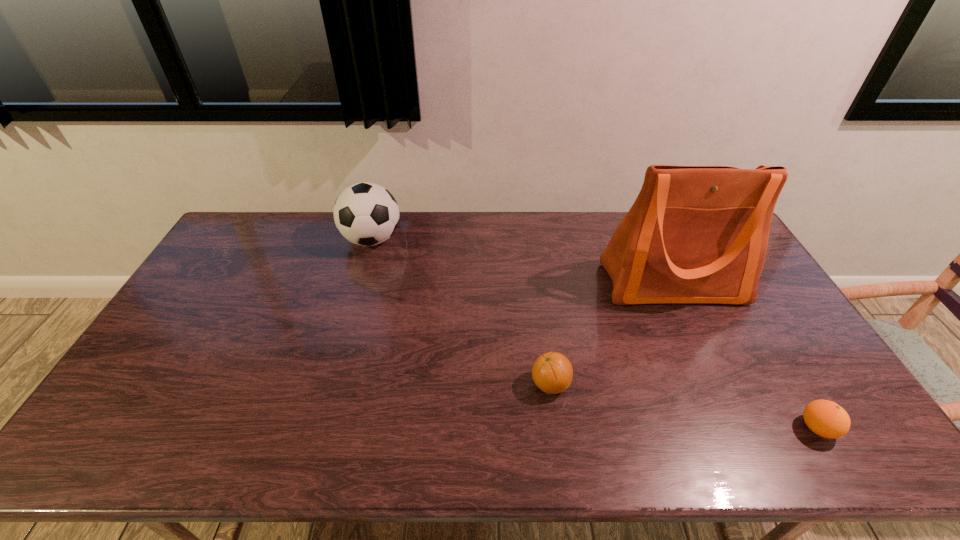
At what (x,y) coordinates should I click in order to perform the action: click on free region located on the back of the right orange. Please return your answer as a coordinate pair (x, y). Looking at the image, I should click on (780, 366).

At what (x,y) coordinates should I click in order to perform the action: click on object at the far edge. Please return your answer as a coordinate pair (x, y). This screenshot has width=960, height=540. Looking at the image, I should click on (367, 214).

In order to click on object situated at the near edge in this screenshot , I will do `click(825, 418)`.

Locate an element on the screen. This screenshot has width=960, height=540. shopping bag located at the right edge is located at coordinates (695, 234).

You are a GUI agent. You are given a task and a screenshot of the screen. Output one action in this format:
    pyautogui.click(x=<x>, y=<y>)
    Task: Click on the orange that is at the right edge
    
    Given the screenshot: What is the action you would take?
    pyautogui.click(x=825, y=418)

The width and height of the screenshot is (960, 540). Identify the location of object that is at the near right corner. (825, 418).

This screenshot has height=540, width=960. I want to click on blank space at the far edge of the desktop, so [x=345, y=246].

The height and width of the screenshot is (540, 960). Identify the location of vacant space at the near edge of the desktop. (452, 449).

What are the coordinates of `vacant space at the left edge of the desktop` in the screenshot? It's located at (252, 258).

The image size is (960, 540). In order to click on free spot between the leftmost object and the shortest object in this screenshot , I will do `click(594, 334)`.